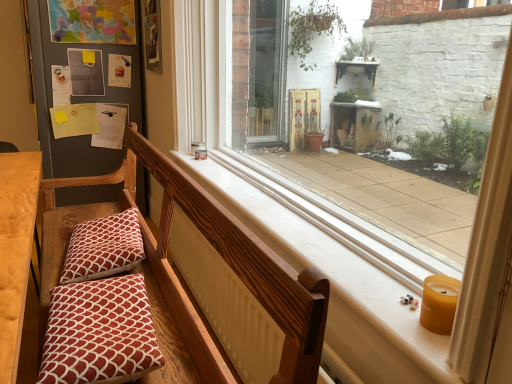
Find the location of a particular element. This screenshot has width=512, height=384. free space to the left of yellow wax candle at lower right is located at coordinates (387, 311).